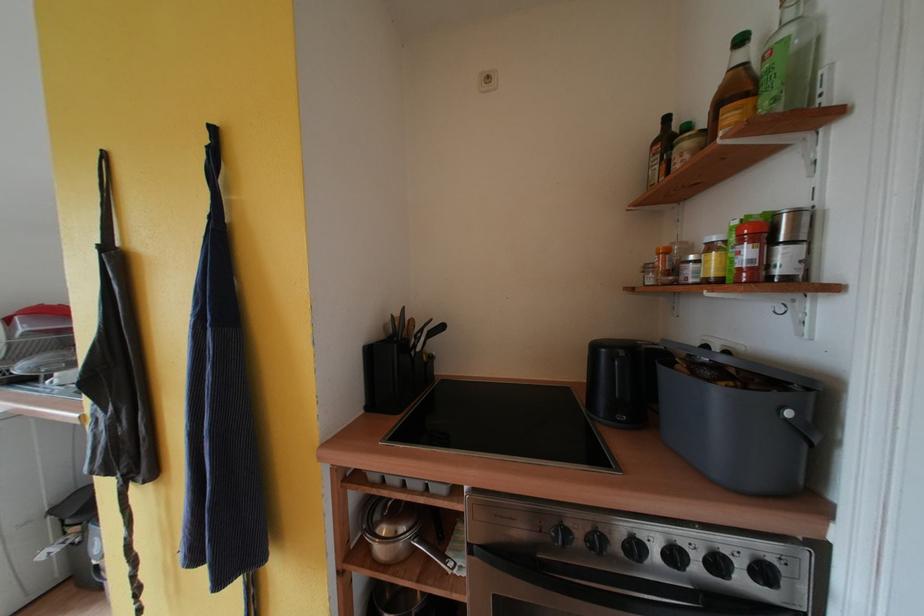
Which object does [737,419] point to?

It refers to a black electric kettle.